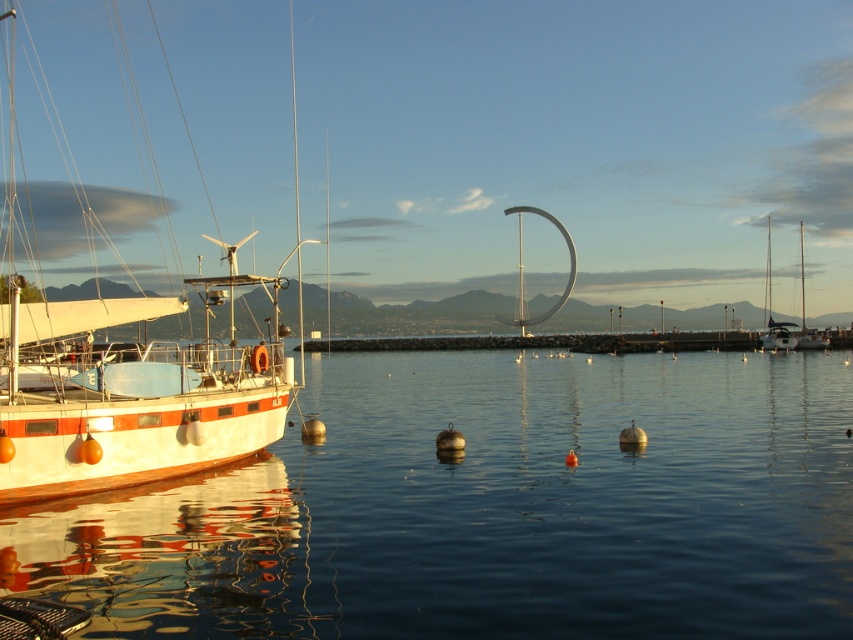
Does white matte boat at left have a larger size compared to white glossy sailboat at right?

Yes.

Is white matte boat at left closer to camera compared to white glossy sailboat at right?

Yes, white matte boat at left is closer to the viewer.

Where is `white matte boat at left`? This screenshot has width=853, height=640. white matte boat at left is located at coordinates (132, 392).

Can you confirm if white matte boat at left is positioned below white matte sailboat at right?

No.

Can you confirm if white matte boat at left is shorter than white matte sailboat at right?

In fact, white matte boat at left may be taller than white matte sailboat at right.

Is point (165, 362) closer to viewer compared to point (769, 337)?

Yes.

You are a GUI agent. You are given a task and a screenshot of the screen. Output one action in this format:
    pyautogui.click(x=<x>, y=<y>)
    Task: Click on the white matte boat at left
    This screenshot has height=640, width=853.
    Given the screenshot: What is the action you would take?
    pyautogui.click(x=132, y=392)

Is transparent water at center smaller than white matte boat at left?

Yes.

Is transparent water at center positioned behind white matte boat at left?

That is False.

Who is more forward, (453, 541) or (84, 435)?

Point (453, 541) is in front.

Identify the location of transparent water at center. This screenshot has width=853, height=640. (486, 508).